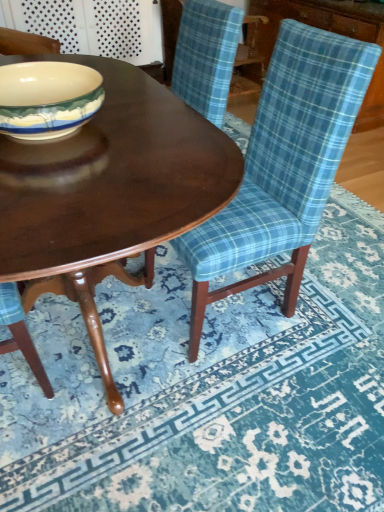
Describe the element at coordinates (110, 194) in the screenshot. I see `shiny dark wood coffee table at center` at that location.

I want to click on matte ceramic bowl at center-left, so click(x=47, y=99).

The height and width of the screenshot is (512, 384). I want to click on blue plaid fabric at lower right, so click(x=210, y=391).

Is blue plaid fabric at lower right surrounded by blue plaid fabric chair at center?

No, blue plaid fabric chair at center does not contain blue plaid fabric at lower right.

Based on the photo, would you say blue plaid fabric chair at center is to the left or to the right of blue plaid fabric at lower right in the picture?

blue plaid fabric chair at center is positioned on blue plaid fabric at lower right's left side.

Consider the image. How different are the orientations of blue plaid fabric chair at center and blue plaid fabric at lower right in degrees?

blue plaid fabric chair at center and blue plaid fabric at lower right are facing 179 degrees away from each other.

Is blue plaid fabric chair at center positioned with its back to blue plaid fabric at lower right?

blue plaid fabric chair at center is not turned away from blue plaid fabric at lower right.

Based on the photo, which object is closer to the camera, shiny dark wood coffee table at center or matte ceramic bowl at center-left?

shiny dark wood coffee table at center is closer to the camera.

Are shiny dark wood coffee table at center and matte ceramic bowl at center-left far apart?

They are positioned close to each other.

Between shiny dark wood coffee table at center and matte ceramic bowl at center-left, which one appears on the right side from the viewer's perspective?

shiny dark wood coffee table at center is more to the right.

Does shiny dark wood coffee table at center have a larger size compared to matte ceramic bowl at center-left?

Indeed, shiny dark wood coffee table at center has a larger size compared to matte ceramic bowl at center-left.

How many degrees apart are the facing directions of blue plaid fabric chair at center and shiny dark wood coffee table at center?

The angle between the facing direction of blue plaid fabric chair at center and the facing direction of shiny dark wood coffee table at center is 3.84 degrees.

Does point (200, 267) come farther from viewer compared to point (71, 294)?

No, it is in front of (71, 294).

Between blue plaid fabric chair at center and shiny dark wood coffee table at center, which one has smaller width?

Thinner between the two is blue plaid fabric chair at center.

Is blue plaid fabric chair at center next to shiny dark wood coffee table at center?

No.

Between shiny dark wood coffee table at center and blue plaid fabric chair at center, which one appears on the right side from the viewer's perspective?

blue plaid fabric chair at center.

Can you confirm if shiny dark wood coffee table at center is taller than blue plaid fabric chair at center?

In fact, shiny dark wood coffee table at center may be shorter than blue plaid fabric chair at center.

Which is more to the right, blue plaid fabric at lower right or blue plaid fabric chair at center?

Positioned to the right is blue plaid fabric at lower right.

Consider the image. Does blue plaid fabric at lower right have a larger size compared to blue plaid fabric chair at center?

Actually, blue plaid fabric at lower right might be smaller than blue plaid fabric chair at center.

Is blue plaid fabric at lower right not close to blue plaid fabric chair at center?

They are positioned close to each other.

From a real-world perspective, does blue plaid fabric at lower right sit lower than shiny dark wood coffee table at center?

Yes, from a real-world perspective, blue plaid fabric at lower right is under shiny dark wood coffee table at center.

Identify the location of place mat below the shiny dark wood coffee table at center (from a real-world perspective). [210, 391].

Can you confirm if blue plaid fabric at lower right is smaller than shiny dark wood coffee table at center?

Indeed, blue plaid fabric at lower right has a smaller size compared to shiny dark wood coffee table at center.

Which object is thinner, blue plaid fabric at lower right or shiny dark wood coffee table at center?

shiny dark wood coffee table at center.

Does shiny dark wood coffee table at center come behind blue plaid fabric at lower right?

No, shiny dark wood coffee table at center is in front of blue plaid fabric at lower right.

Which is behind, point (140, 250) or point (168, 443)?

The point (168, 443) is behind.

Is blue plaid fabric at lower right inside shiny dark wood coffee table at center?

No, blue plaid fabric at lower right is located outside of shiny dark wood coffee table at center.

Consider the image. Does shiny dark wood coffee table at center touch blue plaid fabric at lower right?

No, shiny dark wood coffee table at center is not making contact with blue plaid fabric at lower right.

The image size is (384, 512). I want to click on place mat on the right of blue plaid fabric chair at center, so [x=210, y=391].

The width and height of the screenshot is (384, 512). Find the location of `bowl lying on the left of shiny dark wood coffee table at center`. bowl lying on the left of shiny dark wood coffee table at center is located at coordinates (47, 99).

Estimate the real-world distances between objects in this image. Which object is further from matte ceramic bowl at center-left, blue plaid fabric at lower right or blue plaid fabric chair at center?

The object further to matte ceramic bowl at center-left is blue plaid fabric at lower right.

When comparing their distances from blue plaid fabric at lower right, does shiny dark wood coffee table at center or blue plaid fabric chair at center seem closer?

blue plaid fabric chair at center.

Considering their positions, is shiny dark wood coffee table at center positioned further to blue plaid fabric chair at center than matte ceramic bowl at center-left?

The object further to blue plaid fabric chair at center is matte ceramic bowl at center-left.

Which object lies further to the anchor point blue plaid fabric at lower right, blue plaid fabric chair at center or shiny dark wood coffee table at center?

shiny dark wood coffee table at center.

When comparing their distances from matte ceramic bowl at center-left, does shiny dark wood coffee table at center or blue plaid fabric at lower right seem closer?

Among the two, shiny dark wood coffee table at center is located nearer to matte ceramic bowl at center-left.

When comparing their distances from shiny dark wood coffee table at center, does blue plaid fabric chair at center or blue plaid fabric at lower right seem further?

blue plaid fabric at lower right.

Based on the photo, which object lies nearer to the anchor point blue plaid fabric at lower right, matte ceramic bowl at center-left or shiny dark wood coffee table at center?

shiny dark wood coffee table at center is closer to blue plaid fabric at lower right.

From the image, which object appears to be farther from blue plaid fabric at lower right, matte ceramic bowl at center-left or blue plaid fabric chair at center?

matte ceramic bowl at center-left is positioned further to the anchor blue plaid fabric at lower right.

The width and height of the screenshot is (384, 512). Find the location of `coffee table between matte ceramic bowl at center-left and blue plaid fabric at lower right from left to right`. coffee table between matte ceramic bowl at center-left and blue plaid fabric at lower right from left to right is located at coordinates (110, 194).

Find the location of a particular element. coffee table between matte ceramic bowl at center-left and blue plaid fabric chair at center in the horizontal direction is located at coordinates (110, 194).

Find the location of `chair between matte ceramic bowl at center-left and blue plaid fabric at lower right from left to right`. chair between matte ceramic bowl at center-left and blue plaid fabric at lower right from left to right is located at coordinates (283, 166).

Where is `chair between shiny dark wood coffee table at center and blue plaid fabric at lower right`? This screenshot has width=384, height=512. chair between shiny dark wood coffee table at center and blue plaid fabric at lower right is located at coordinates (283, 166).